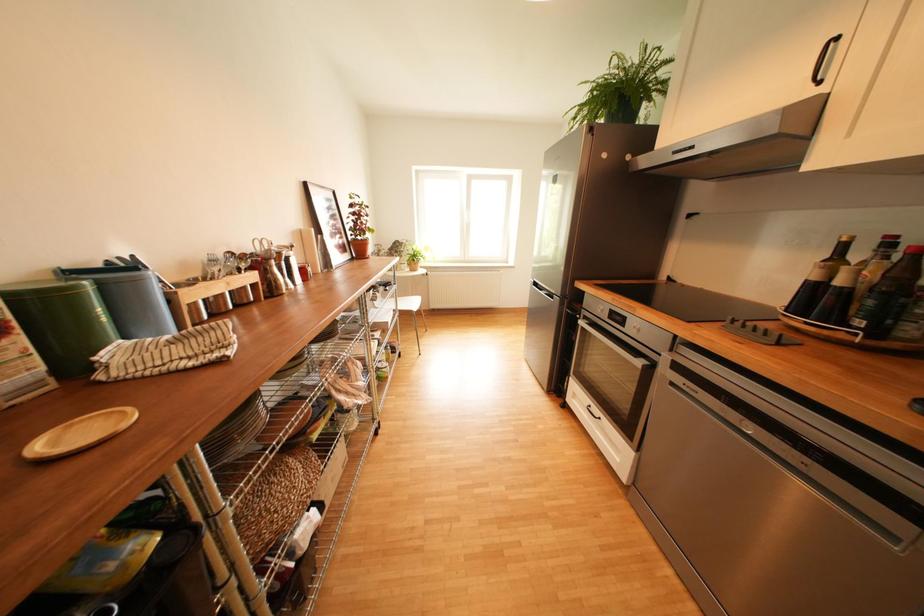
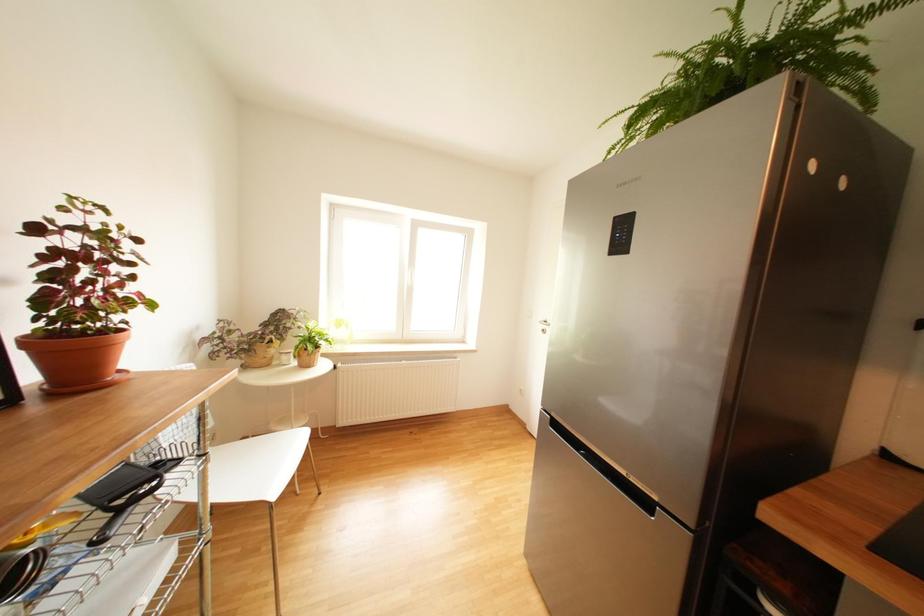
Question: Which direction would the cameraman need to move to produce the second image? Reply with the corresponding letter.

Choices:
 (A) Left
 (B) Right
 (C) Forward
 (D) Backward

Answer: (C)